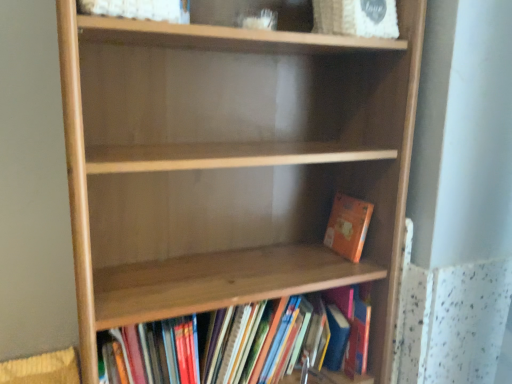
Question: Is wooden bookshelf at lower center, acting as the 2th book starting from the top, located within orange matte book at lower right, positioned as the second book in bottom-to-top order?

Choices:
 (A) yes
 (B) no

Answer: (B)

Question: Is there a large distance between orange matte book at lower right, the first book viewed from the top, and wooden bookshelf at lower center, which is the first book in bottom-to-top order?

Choices:
 (A) no
 (B) yes

Answer: (A)

Question: Is orange matte book at lower right, positioned as the second book in bottom-to-top order, not within wooden bookshelf at lower center, acting as the 2th book starting from the top?

Choices:
 (A) yes
 (B) no

Answer: (A)

Question: Can you confirm if orange matte book at lower right, the first book viewed from the top, is positioned to the right of wooden bookshelf at lower center, which is the first book in bottom-to-top order?

Choices:
 (A) no
 (B) yes

Answer: (B)

Question: From the image's perspective, is orange matte book at lower right, the first book viewed from the top, located above wooden bookshelf at lower center, acting as the 2th book starting from the top?

Choices:
 (A) no
 (B) yes

Answer: (B)

Question: From the image's perspective, is wooden bookshelf at lower center, which is the first book in bottom-to-top order, located above or below orange matte book at lower right, the first book viewed from the top?

Choices:
 (A) above
 (B) below

Answer: (B)

Question: In terms of size, does wooden bookshelf at lower center, which is the first book in bottom-to-top order, appear bigger or smaller than orange matte book at lower right, positioned as the second book in bottom-to-top order?

Choices:
 (A) big
 (B) small

Answer: (A)

Question: Is wooden bookshelf at lower center, acting as the 2th book starting from the top, situated inside orange matte book at lower right, the first book viewed from the top, or outside?

Choices:
 (A) outside
 (B) inside

Answer: (A)

Question: Visually, is wooden bookshelf at lower center, which is the first book in bottom-to-top order, positioned to the left or to the right of orange matte book at lower right, positioned as the second book in bottom-to-top order?

Choices:
 (A) right
 (B) left

Answer: (B)

Question: From a real-world perspective, is orange matte book at lower right, the first book viewed from the top, positioned above or below wooden bookshelf at lower center, which is the first book in bottom-to-top order?

Choices:
 (A) below
 (B) above

Answer: (B)

Question: In terms of height, does orange matte book at lower right, the first book viewed from the top, look taller or shorter compared to wooden bookshelf at lower center, acting as the 2th book starting from the top?

Choices:
 (A) short
 (B) tall

Answer: (A)

Question: In terms of width, does orange matte book at lower right, the first book viewed from the top, look wider or thinner when compared to wooden bookshelf at lower center, acting as the 2th book starting from the top?

Choices:
 (A) wide
 (B) thin

Answer: (B)

Question: Is point (353, 205) closer or farther from the camera than point (317, 380)?

Choices:
 (A) farther
 (B) closer

Answer: (B)

Question: From a real-world perspective, relative to wooden bookshelf at lower center, which is the first book in bottom-to-top order, is natural wood shelf at center vertically above or below?

Choices:
 (A) above
 (B) below

Answer: (A)

Question: Considering the positions of natural wood shelf at center and wooden bookshelf at lower center, acting as the 2th book starting from the top, in the image, is natural wood shelf at center taller or shorter than wooden bookshelf at lower center, acting as the 2th book starting from the top,?

Choices:
 (A) tall
 (B) short

Answer: (A)